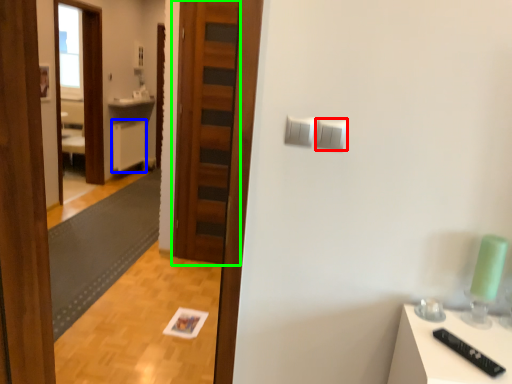
Question: Estimate the real-world distances between objects in this image. Which object is closer to light switch (highlighted by a red box), cabinetry (highlighted by a blue box) or door (highlighted by a green box)?

Choices:
 (A) cabinetry
 (B) door

Answer: (B)